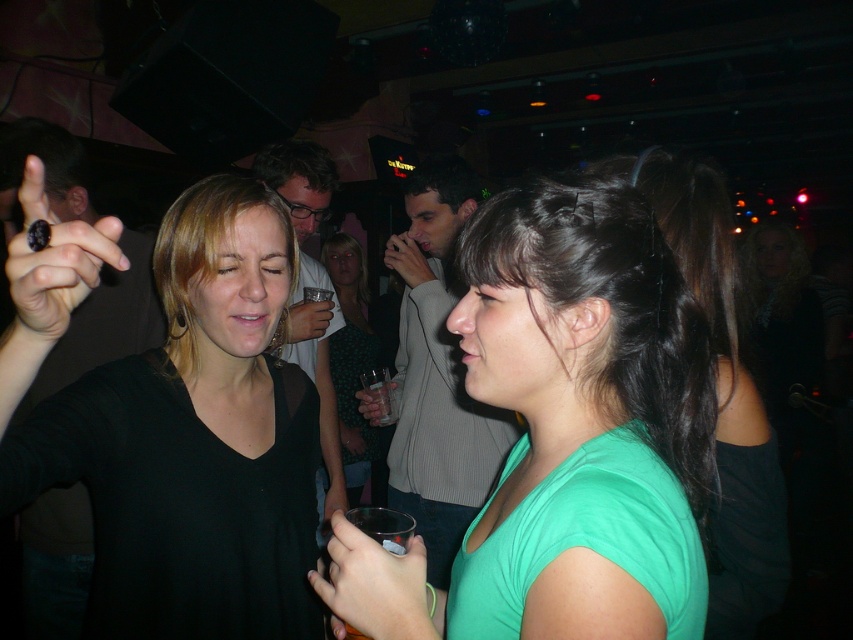
Question: Does green matte hair at center come behind green fabric dress at center?

Choices:
 (A) no
 (B) yes

Answer: (A)

Question: Which point is closer to the camera taking this photo?

Choices:
 (A) (351, 246)
 (B) (651, 426)
 (C) (692, 172)

Answer: (B)

Question: Which object is closer to the camera taking this photo?

Choices:
 (A) green fabric dress at center
 (B) green matte hair at center
 (C) gray sweater at center
 (D) matte black shirt at center

Answer: (B)

Question: Among these points, which one is farthest from the camera?

Choices:
 (A) pos(289,141)
 (B) pos(180,497)
 (C) pos(62,330)

Answer: (A)

Question: Can you confirm if matte black ring at upper left is positioned below matte black shirt at center?

Choices:
 (A) no
 (B) yes

Answer: (A)

Question: From the image, what is the correct spatial relationship of black matte shirt at upper left in relation to translucent plastic cup at lower center?

Choices:
 (A) right
 (B) left

Answer: (B)